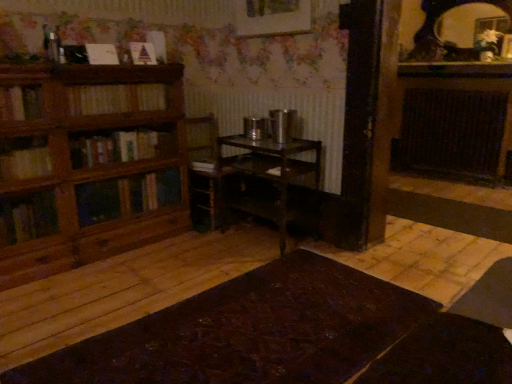
Where is `free point in front of wooden bookshelf at left`? free point in front of wooden bookshelf at left is located at coordinates (94, 301).